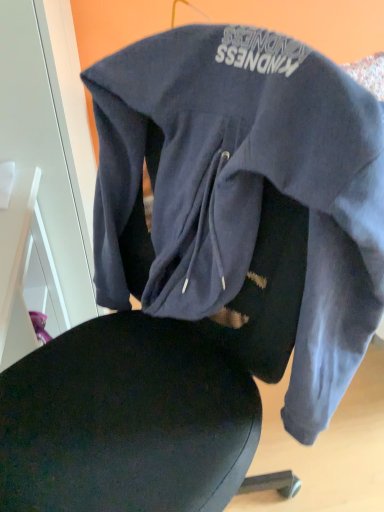
Where is `dark blue fleece jacket at center`? dark blue fleece jacket at center is located at coordinates (243, 195).

What do you see at coordinates (243, 195) in the screenshot? Image resolution: width=384 pixels, height=512 pixels. I see `dark blue fleece jacket at center` at bounding box center [243, 195].

You are a GUI agent. You are given a task and a screenshot of the screen. Output one action in this format:
    pyautogui.click(x=<x>, y=<y>)
    Task: Click on the dark blue fleece jacket at center
    The width and height of the screenshot is (384, 512).
    Given the screenshot: What is the action you would take?
    pyautogui.click(x=243, y=195)